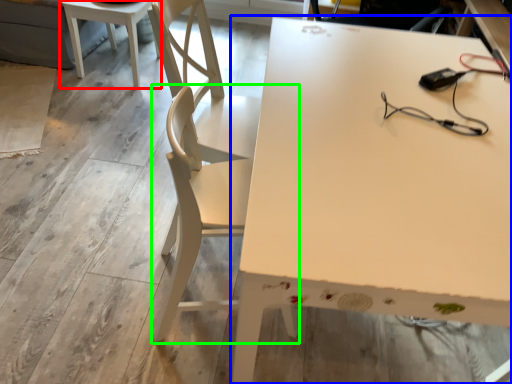
Question: Based on their relative distances, which object is nearer to table (highlighted by a red box)? Choose from table (highlighted by a blue box) and chair (highlighted by a green box).

Choices:
 (A) table
 (B) chair

Answer: (B)